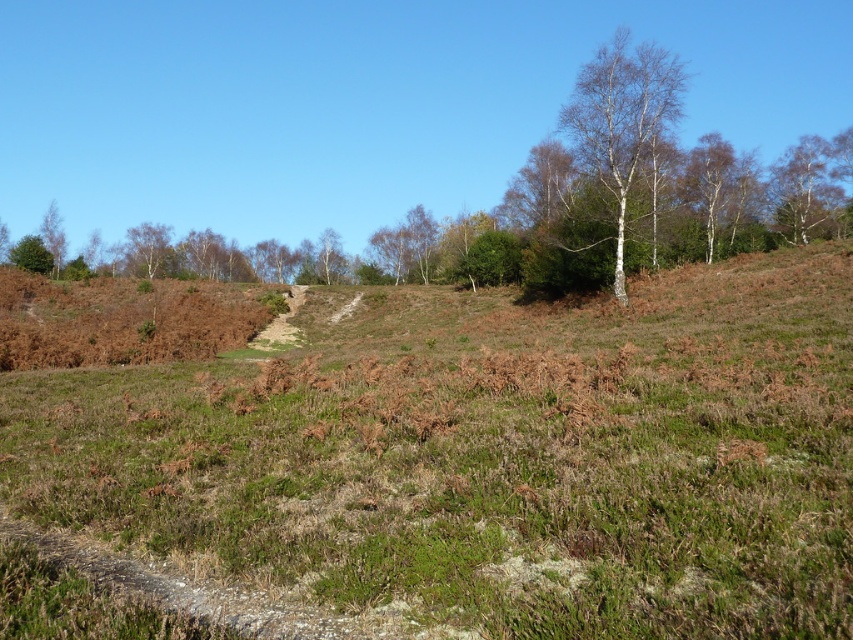
Consider the image. Is white smooth tree at upper right shorter than green leafy tree at upper left?

No.

Can you confirm if white smooth tree at upper right is positioned above green leafy tree at upper left?

Yes, white smooth tree at upper right is above green leafy tree at upper left.

Does point (769, 205) come farther from viewer compared to point (33, 268)?

That is False.

Locate an element on the screen. white smooth tree at upper right is located at coordinates (808, 184).

Does green grassy at center appear on the left side of white bark tree at upper right?

Indeed, green grassy at center is positioned on the left side of white bark tree at upper right.

Who is higher up, green grassy at center or white bark tree at upper right?

white bark tree at upper right is above.

Who is more forward, (x=485, y=605) or (x=598, y=170)?

Point (x=485, y=605) is more forward.

Locate an element on the screen. green grassy at center is located at coordinates (490, 458).

Can you confirm if white bark tree at upper right is smaller than green leafy tree at upper left?

Actually, white bark tree at upper right might be larger than green leafy tree at upper left.

This screenshot has height=640, width=853. I want to click on white bark tree at upper right, so click(621, 116).